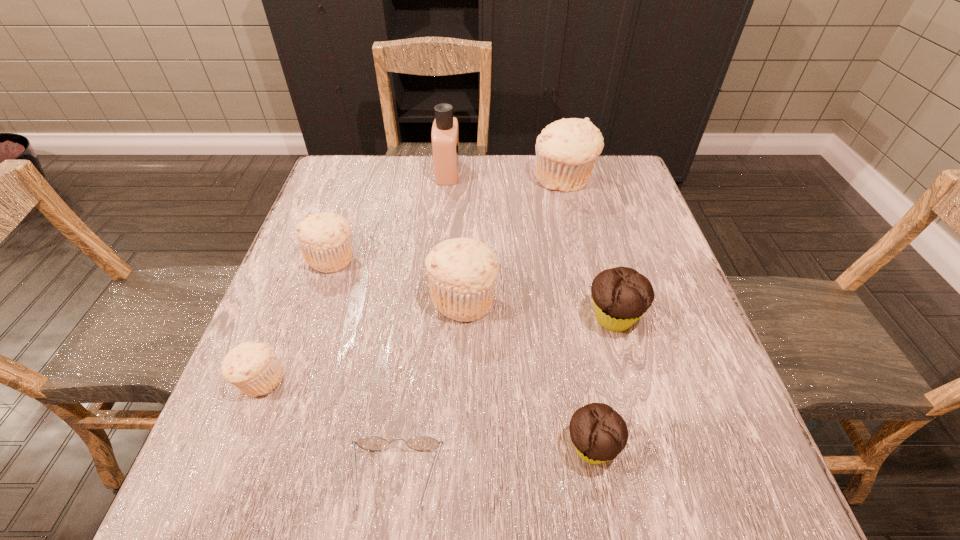
You are a GUI agent. You are given a task and a screenshot of the screen. Output one action in this format:
    pyautogui.click(x=<x>, y=<y>)
    Task: Click on the free spot between the nearest muffin and the fourth muffin from right to left
    The width and height of the screenshot is (960, 540).
    Given the screenshot: What is the action you would take?
    pos(528,373)

I want to click on object that is the sixth nearest to the smaller chocolate muffin, so click(566, 150).

Find the location of `object that stands as the seventh closest to the second nearest muffin`. object that stands as the seventh closest to the second nearest muffin is located at coordinates (566, 150).

The height and width of the screenshot is (540, 960). In order to click on muffin that is the second closest to the bigger chocolate muffin in this screenshot , I will do `click(462, 272)`.

Find the location of `muffin that is the closest one to the nearest beige muffin`. muffin that is the closest one to the nearest beige muffin is located at coordinates [x=324, y=238].

Identify the location of beige muffin that can be found as the closest to the third muffin from left to right. point(324,238).

This screenshot has height=540, width=960. In order to click on beige muffin that is the third nearest to the third smallest beige muffin in this screenshot , I will do (566, 150).

This screenshot has width=960, height=540. I want to click on vacant space that satisfies the following two spatial constraints: 1. on the back side of the third tallest object; 2. on the left side of the smallest beige muffin, so [293, 299].

In order to click on free space that satisfies the following two spatial constraints: 1. on the back side of the farthest muffin; 2. on the left side of the fifth shortest muffin in this screenshot , I will do `click(468, 180)`.

What are the coordinates of `free spot that satisfies the following two spatial constraints: 1. on the front side of the farther chocolate muffin; 2. on the left side of the third tallest object` in the screenshot? It's located at (463, 318).